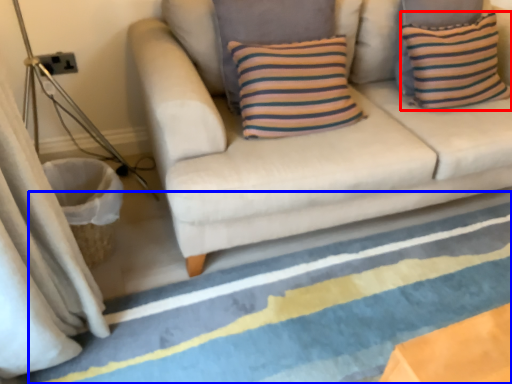
Question: Which object is further to the camera taking this photo, pillow (highlighted by a red box) or strip (highlighted by a blue box)?

Choices:
 (A) pillow
 (B) strip

Answer: (A)